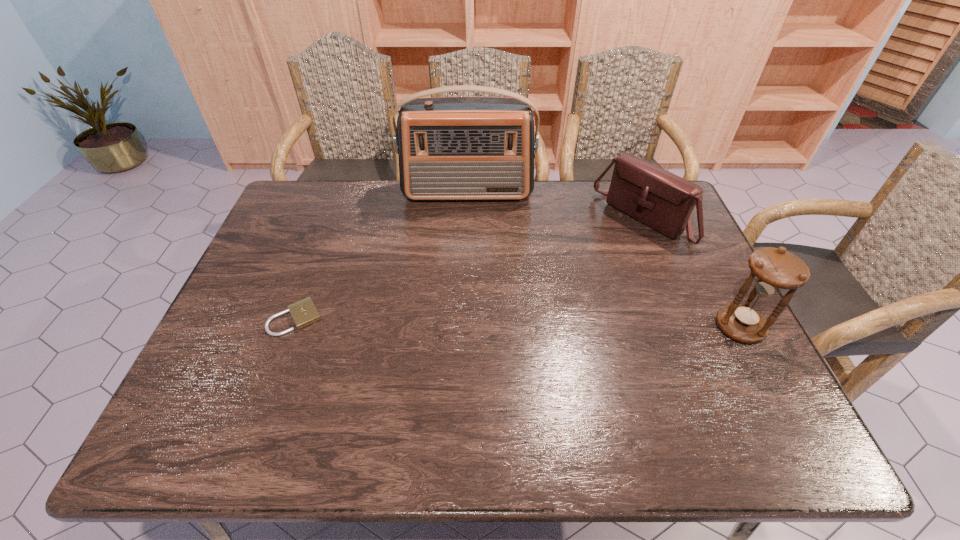
Where is `free region at the far edge of the desktop`? The width and height of the screenshot is (960, 540). free region at the far edge of the desktop is located at coordinates pos(462,211).

Locate an element on the screen. vacant space at the near edge of the desktop is located at coordinates (351, 392).

In the image, there is a desktop. Identify the location of free region at the left edge. [265, 332].

At what (x,y) coordinates should I click in order to perform the action: click on free space at the right edge of the desktop. Please return your answer as a coordinate pair (x, y). The image size is (960, 540). Looking at the image, I should click on (678, 311).

The image size is (960, 540). In the image, there is a desktop. Identify the location of blank space at the far left corner. click(318, 217).

At what (x,y) coordinates should I click in order to perform the action: click on free space between the leftmost object and the second shortest object. Please return your answer as a coordinate pair (x, y). The width and height of the screenshot is (960, 540). Looking at the image, I should click on (468, 269).

Where is `free space that is in between the second tallest object and the second object from left to right`? Image resolution: width=960 pixels, height=540 pixels. free space that is in between the second tallest object and the second object from left to right is located at coordinates (604, 260).

Identify the location of vacant area that lies between the radio receiver and the hourglass. (604, 260).

Image resolution: width=960 pixels, height=540 pixels. I want to click on unoccupied area between the tallest object and the shoulder bag, so click(555, 207).

The width and height of the screenshot is (960, 540). Find the location of `vacant area that lies between the second tallest object and the third object from right to left`. vacant area that lies between the second tallest object and the third object from right to left is located at coordinates (604, 260).